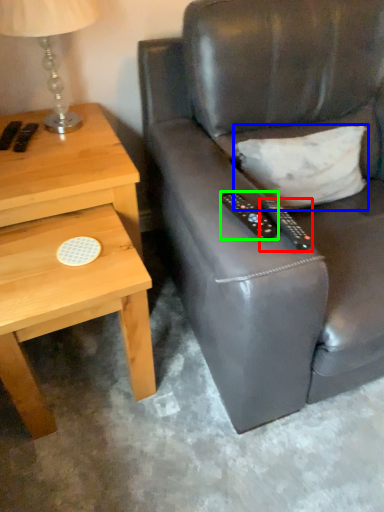
Question: Considering the real-world distances, which object is closest to remote control (highlighted by a red box)? pillow (highlighted by a blue box) or remote control (highlighted by a green box).

Choices:
 (A) pillow
 (B) remote control

Answer: (B)